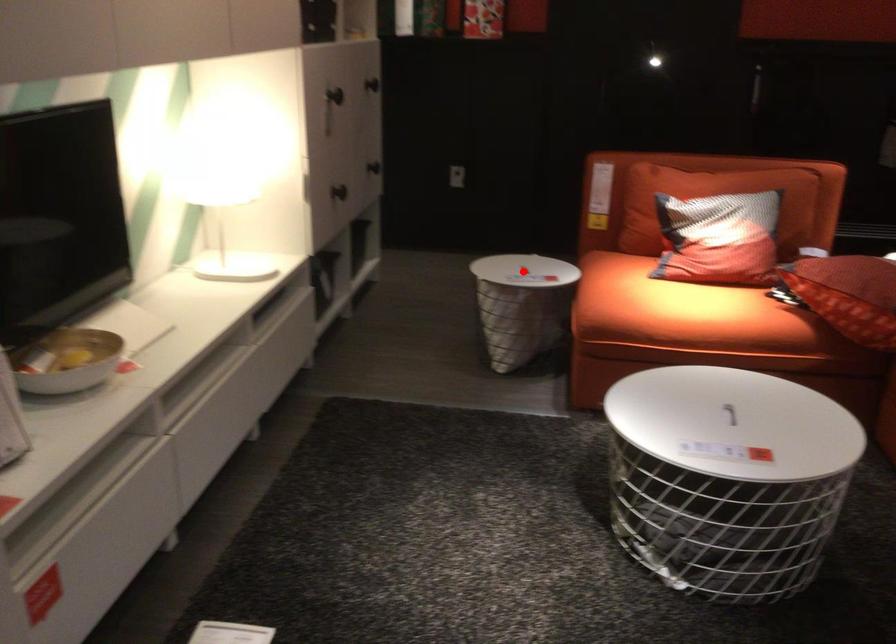
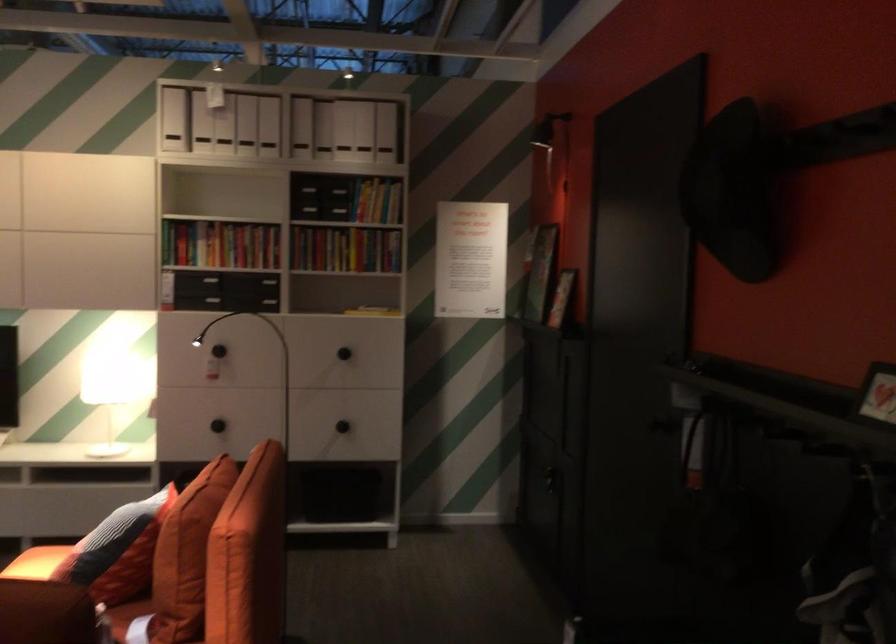
Question: I am providing you with two images of the same scene from different viewpoints. A red point is marked on the first image. Is the red point's position out of view in image 2?

Choices:
 (A) Yes
 (B) No

Answer: (A)